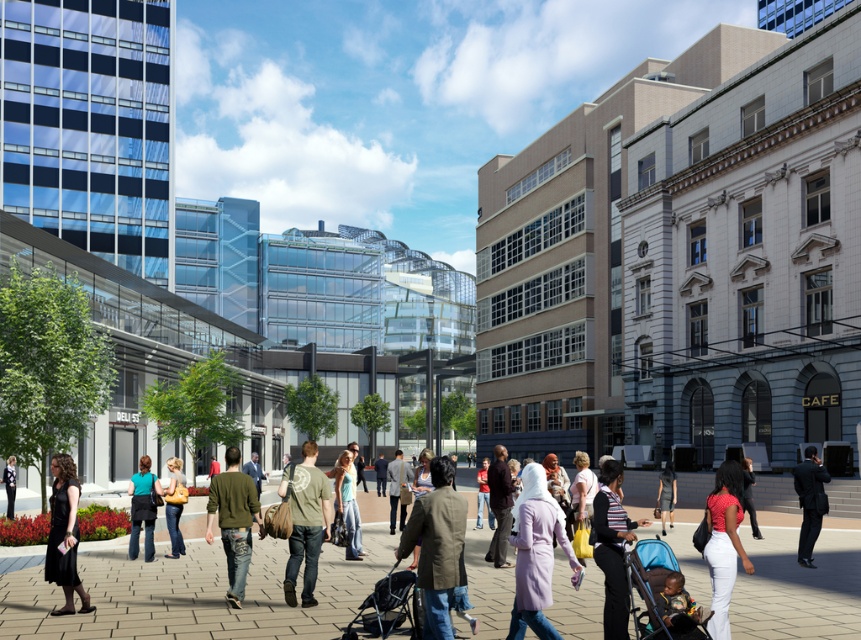
Question: In this image, where is purple fabric coat at center located relative to striped sweater at center?

Choices:
 (A) below
 (B) above

Answer: (A)

Question: Estimate the real-world distances between objects in this image. Which object is farther from the dark brown leather handbag at center?

Choices:
 (A) striped sweater at center
 (B) denim jacket at center
 (C) khaki fabric jacket at center

Answer: (C)

Question: Is green cotton t-shirt at center wider than matte black jacket at lower left?

Choices:
 (A) no
 (B) yes

Answer: (A)

Question: Which object is farther from the camera taking this photo?

Choices:
 (A) purple fabric coat at center
 (B) green denim jeans at center
 (C) matte yellow handbag at center

Answer: (C)

Question: Which object is closer to the camera taking this photo?

Choices:
 (A) black leather jacket at center
 (B) purple fabric coat at center

Answer: (B)

Question: Can you confirm if dark brown leather handbag at center is wider than matte black jacket at lower left?

Choices:
 (A) yes
 (B) no

Answer: (A)